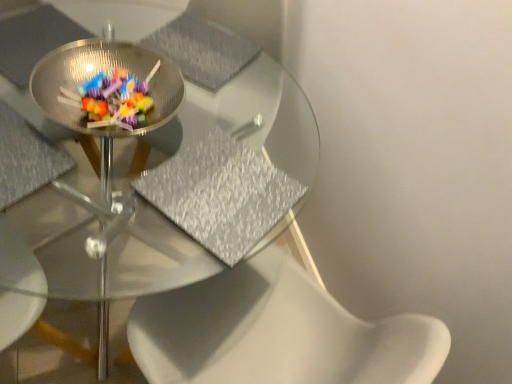
Question: From the image's perspective, relative to metallic silver chair at center, is transparent glass table at center above or below?

Choices:
 (A) below
 (B) above

Answer: (A)

Question: Based on their positions, is transparent glass table at center located to the left or right of metallic silver chair at center?

Choices:
 (A) left
 (B) right

Answer: (B)

Question: Which is farther from the transparent glass table at center?

Choices:
 (A) metallic silver chair at center
 (B) clear glass bowl at center

Answer: (A)

Question: Which object is the farthest from the metallic silver chair at center?

Choices:
 (A) transparent glass table at center
 (B) clear glass bowl at center

Answer: (A)